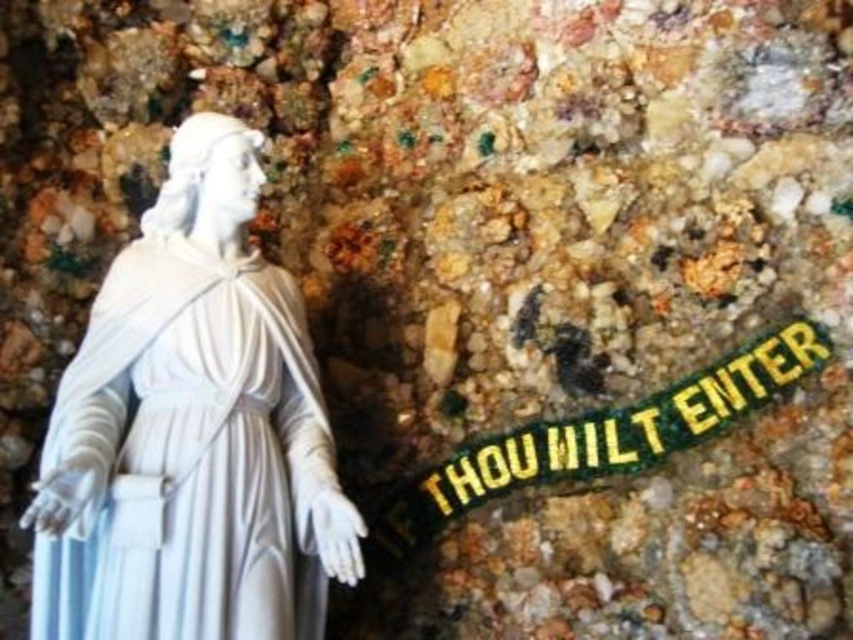
Who is taller, white marble statue at left or green/yellow fabric text at center?

With more height is white marble statue at left.

Which is behind, point (119, 464) or point (699, 384)?

Point (699, 384)

At what (x,y) coordinates should I click in order to perform the action: click on white marble statue at left. Please return your answer as a coordinate pair (x, y). Image resolution: width=853 pixels, height=640 pixels. Looking at the image, I should click on (192, 432).